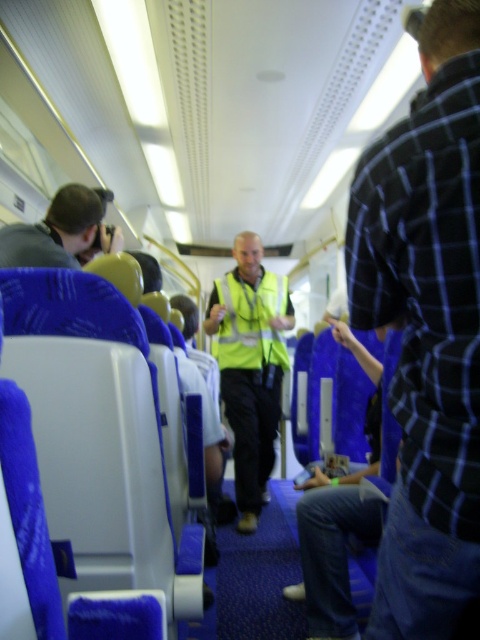
Can you confirm if plaid shirt at right is positioned to the left of yellow reflective safety vest at center?

In fact, plaid shirt at right is to the right of yellow reflective safety vest at center.

Where is `plaid shirt at right`? This screenshot has height=640, width=480. plaid shirt at right is located at coordinates (427, 326).

Where is `plaid shirt at right`? The image size is (480, 640). plaid shirt at right is located at coordinates (427, 326).

Where is `plaid shirt at right`? Image resolution: width=480 pixels, height=640 pixels. plaid shirt at right is located at coordinates (427, 326).

Does plaid shirt at right have a lesser width compared to matte black camera at left?

Correct, plaid shirt at right's width is less than matte black camera at left's.

Is point (415, 212) positioned after point (69, 208)?

That is False.

Identify the location of plaid shirt at right. The height and width of the screenshot is (640, 480). (427, 326).

Does high visibility yellow vest at center have a lesser height compared to matte black camera at left?

In fact, high visibility yellow vest at center may be taller than matte black camera at left.

Image resolution: width=480 pixels, height=640 pixels. What do you see at coordinates (251, 365) in the screenshot? I see `high visibility yellow vest at center` at bounding box center [251, 365].

Is point (252, 394) less distant than point (80, 244)?

No, it is behind (80, 244).

Locate an element on the screen. high visibility yellow vest at center is located at coordinates 251,365.